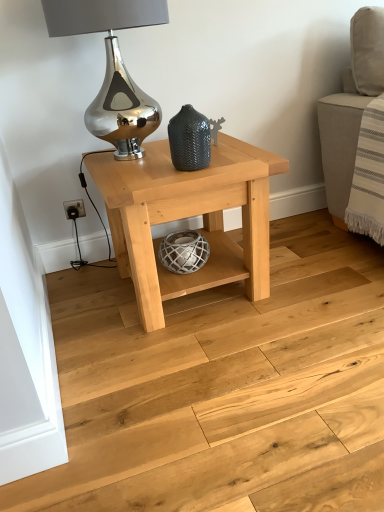
Question: Does natural wood table at center turn towards natural wood floor at center?

Choices:
 (A) yes
 (B) no

Answer: (B)

Question: From a real-world perspective, is natural wood table at center on top of natural wood floor at center?

Choices:
 (A) yes
 (B) no

Answer: (A)

Question: Does natural wood table at center lie behind natural wood floor at center?

Choices:
 (A) yes
 (B) no

Answer: (A)

Question: Is natural wood table at center surrounding natural wood floor at center?

Choices:
 (A) no
 (B) yes

Answer: (A)

Question: Can you confirm if natural wood table at center is taller than natural wood floor at center?

Choices:
 (A) no
 (B) yes

Answer: (B)

Question: From the image's perspective, relative to natural wood floor at center, is matte dark gray textured vase at center above or below?

Choices:
 (A) below
 (B) above

Answer: (B)

Question: Is matte dark gray textured vase at center in front of or behind natural wood floor at center in the image?

Choices:
 (A) behind
 (B) front

Answer: (A)

Question: From a real-world perspective, relative to natural wood floor at center, is matte dark gray textured vase at center vertically above or below?

Choices:
 (A) above
 (B) below

Answer: (A)

Question: Considering the positions of point (196, 143) and point (82, 414), is point (196, 143) closer or farther from the camera than point (82, 414)?

Choices:
 (A) farther
 (B) closer

Answer: (A)

Question: Based on their sizes in the image, would you say natural wood table at center is bigger or smaller than natural wood floor at center?

Choices:
 (A) small
 (B) big

Answer: (B)

Question: In the image, is natural wood table at center on the left side or the right side of natural wood floor at center?

Choices:
 (A) right
 (B) left

Answer: (B)

Question: Is natural wood table at center taller or shorter than natural wood floor at center?

Choices:
 (A) tall
 (B) short

Answer: (A)

Question: From a real-world perspective, is natural wood table at center above or below natural wood floor at center?

Choices:
 (A) above
 (B) below

Answer: (A)

Question: Is natural wood floor at center taller or shorter than natural wood table at center?

Choices:
 (A) short
 (B) tall

Answer: (A)

Question: Which is correct: natural wood floor at center is inside natural wood table at center, or outside of it?

Choices:
 (A) outside
 (B) inside

Answer: (A)